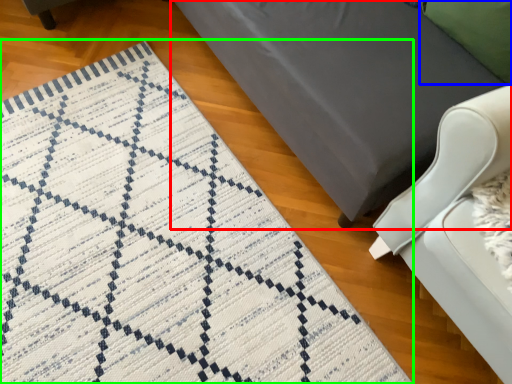
Question: Considering the real-world distances, which object is closest to furniture (highlighted by a red box)? pillow (highlighted by a blue box) or mat (highlighted by a green box).

Choices:
 (A) pillow
 (B) mat

Answer: (A)